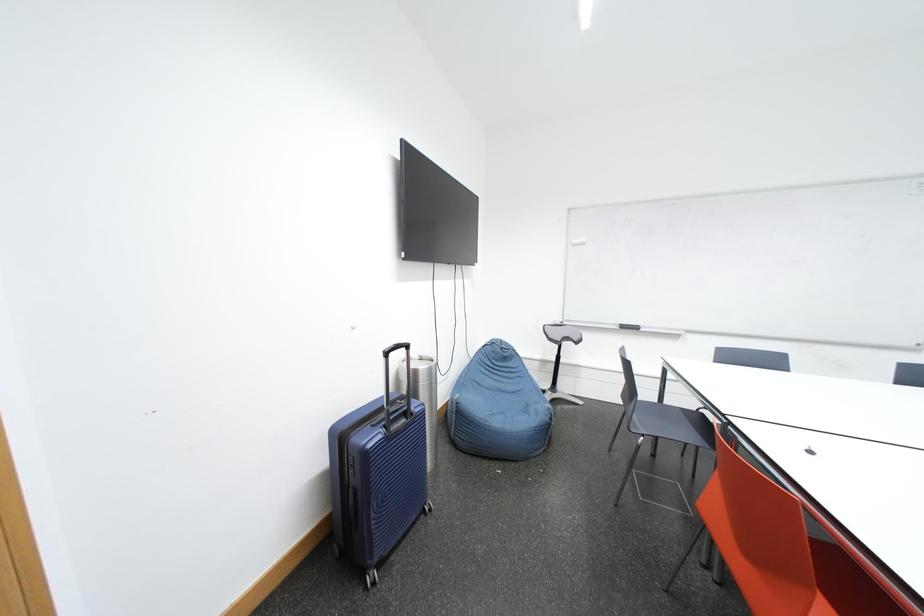
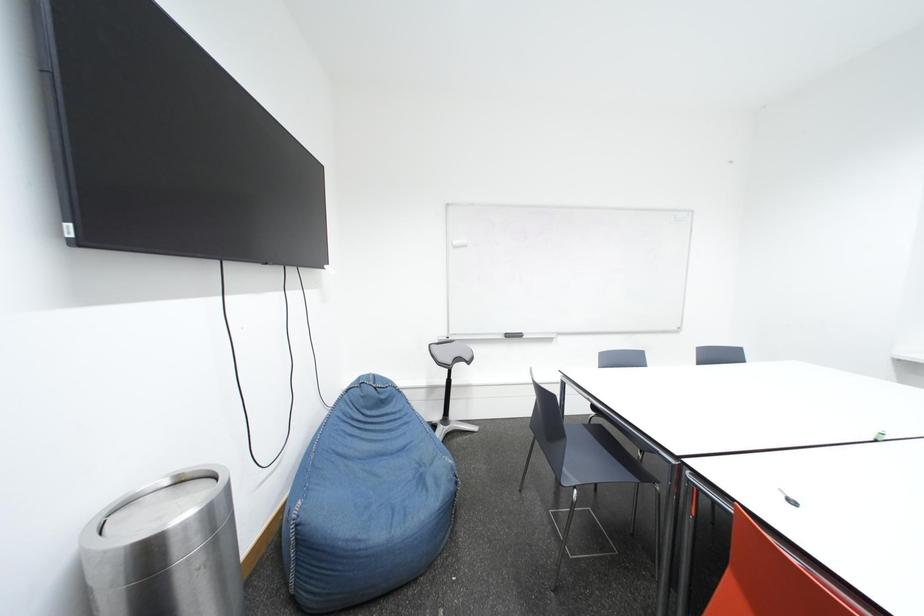
Question: The first image is from the beginning of the video and the second image is from the end. How did the camera likely rotate when shooting the video?

Choices:
 (A) Left
 (B) Right
 (C) Up
 (D) Down

Answer: (B)